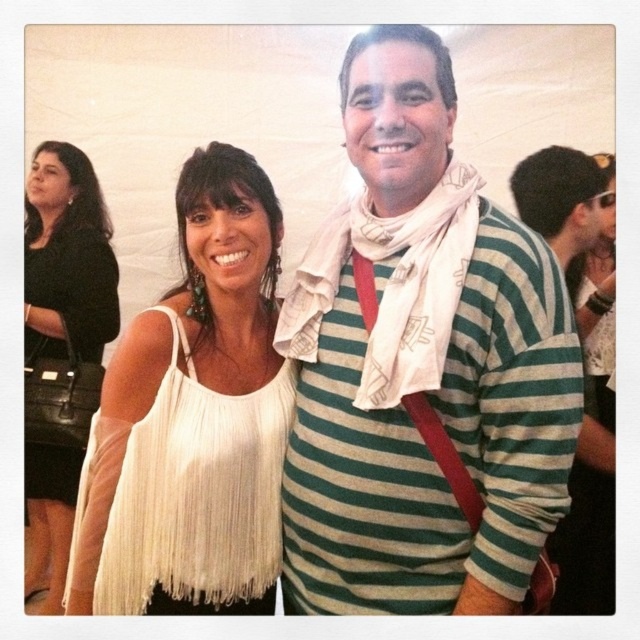
You are planning to place the white textured scarf at center and the black leather purse at left into a storage box. The box can only accommodate items with a width of up to 30 cm. Based on the scene, can both items fit inside the box?

The white textured scarf at center has a larger width than the black leather purse at left. Since the box can only hold items up to 30 cm wide, if the scarf exceeds this limit, it won

You are organizing a clothing rack and need to arrange the green striped shirt at center and the green striped sweater at center vertically. According to the image, which one should be placed higher on the rack?

The green striped shirt at center should be placed higher on the rack since it is positioned above the green striped sweater at center in the image.

You are a photographer trying to focus on the green striped shirt at center. You know that the camera focuses best at the center point of the image, which is at coordinate point (420,365). Is the green striped shirt at center located at the camera focus point?

The green striped shirt at center is located at point (420,365), so yes, it is exactly at the camera focus point.